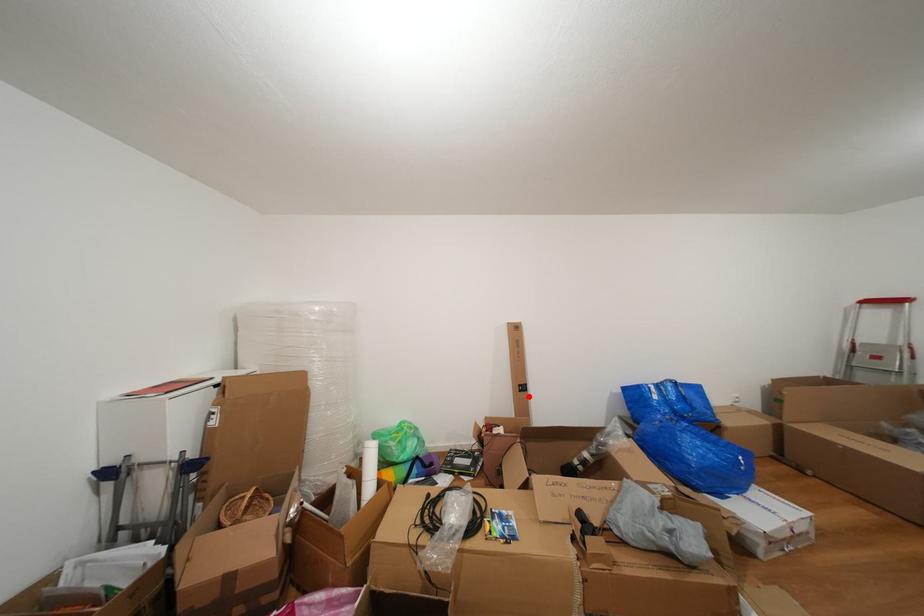
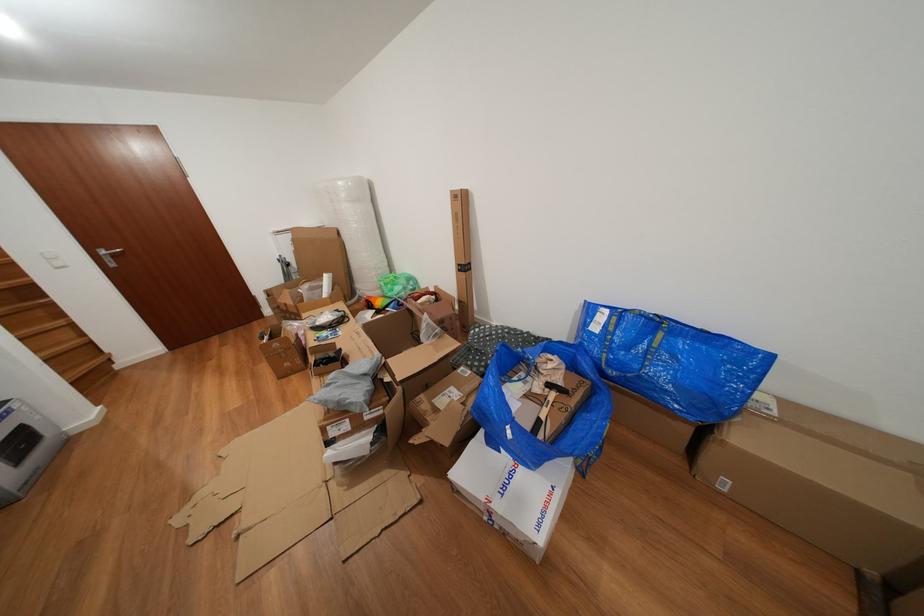
Locate, in the second image, the point that corresponds to the highlighted location in the first image.

(468, 276)